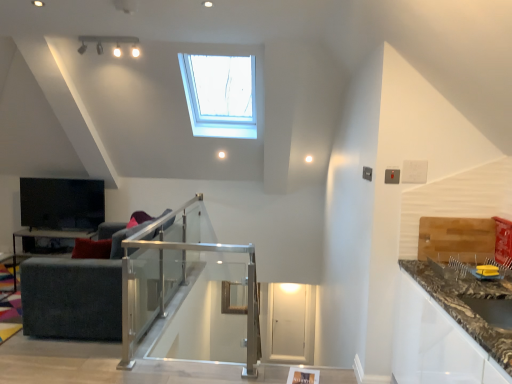
You are a GUI agent. You are given a task and a screenshot of the screen. Output one action in this format:
    pyautogui.click(x=<x>, y=<y>)
    Task: Click on the vacant space that is to the left of clear glass balustrade at center
    The image size is (512, 384).
    Given the screenshot: What is the action you would take?
    pyautogui.click(x=103, y=370)